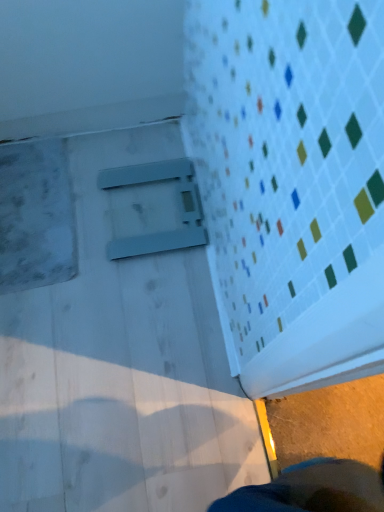
Question: Should I look upward or downward to see matte plastic window at center?

Choices:
 (A) down
 (B) up

Answer: (B)